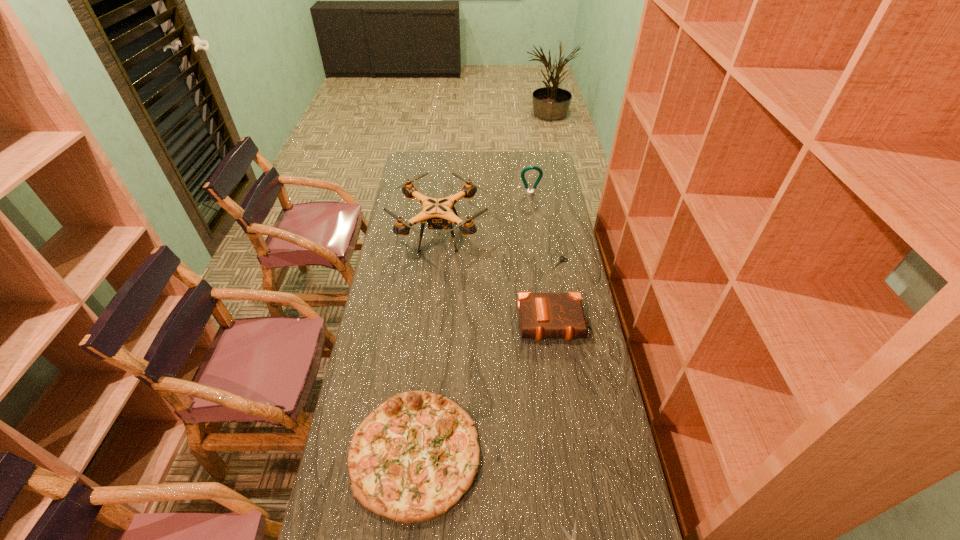
In the image, there is a desktop. What are the coordinates of `free space at the far right corner` in the screenshot? It's located at 539,157.

You are a GUI agent. You are given a task and a screenshot of the screen. Output one action in this format:
    pyautogui.click(x=<x>, y=<y>)
    Task: Click on the vacant area that lies between the second shortest object and the fourth tallest object
    This screenshot has height=540, width=960.
    Given the screenshot: What is the action you would take?
    pyautogui.click(x=488, y=358)

I want to click on free space between the third shortest object and the taller shears, so click(488, 358).

In order to click on vacant area between the drone and the farthest object in this screenshot , I will do `click(485, 214)`.

You are a GUI agent. You are given a task and a screenshot of the screen. Output one action in this format:
    pyautogui.click(x=<x>, y=<y>)
    Task: Click on the unoccupied position between the second tallest object and the drone
    The height and width of the screenshot is (540, 960).
    Given the screenshot: What is the action you would take?
    pyautogui.click(x=485, y=214)

Image resolution: width=960 pixels, height=540 pixels. Identify the location of vacant space in between the third nearest object and the drone. (496, 279).

Locate which object is the fourth closest to the farthest object. Please provide its 2D coordinates. Your answer should be formatted as a tuple, i.e. [(x, y)], where the tuple contains the x and y coordinates of a point satisfying the conditions above.

[(411, 459)]

Locate which object is the fourth closest to the pizza. Please provide its 2D coordinates. Your answer should be formatted as a tuple, i.e. [(x, y)], where the tuple contains the x and y coordinates of a point satisfying the conditions above.

[(561, 260)]

This screenshot has width=960, height=540. In order to click on vacant space that satisfies the following two spatial constraints: 1. on the camera mount of the drone; 2. on the left side of the farther shears in this screenshot , I will do `click(437, 264)`.